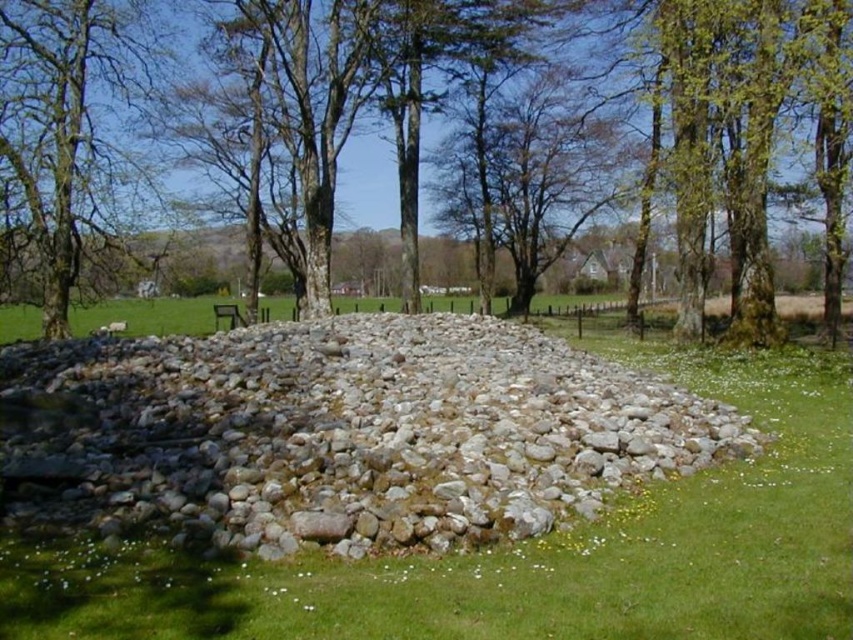
Who is positioned more to the left, gray/rough stone at center or smooth bark tree at center?

gray/rough stone at center is more to the left.

Does gray/rough stone at center have a smaller size compared to smooth bark tree at center?

Yes, gray/rough stone at center is smaller than smooth bark tree at center.

Is point (381, 490) positioned behind point (762, 65)?

No, it is not.

Identify the location of gray/rough stone at center. (346, 432).

Is gray/rough stone at center positioned in front of wooden park bench at center?

Yes, gray/rough stone at center is closer to the viewer.

Does gray/rough stone at center appear under wooden park bench at center?

Correct, gray/rough stone at center is located below wooden park bench at center.

Which is in front, point (358, 326) or point (229, 326)?

Point (358, 326) is in front.

In order to click on gray/rough stone at center in this screenshot , I will do `click(346, 432)`.

You are a GUI agent. You are given a task and a screenshot of the screen. Output one action in this format:
    pyautogui.click(x=<x>, y=<y>)
    Task: Click on the smooth bark tree at center
    The width and height of the screenshot is (853, 640).
    Given the screenshot: What is the action you would take?
    pyautogui.click(x=740, y=134)

Is point (788, 81) behind point (64, 60)?

No, (788, 81) is in front of (64, 60).

Between point (822, 77) and point (126, 92), which one is positioned behind?

Positioned behind is point (126, 92).

I want to click on smooth bark tree at center, so click(x=740, y=134).